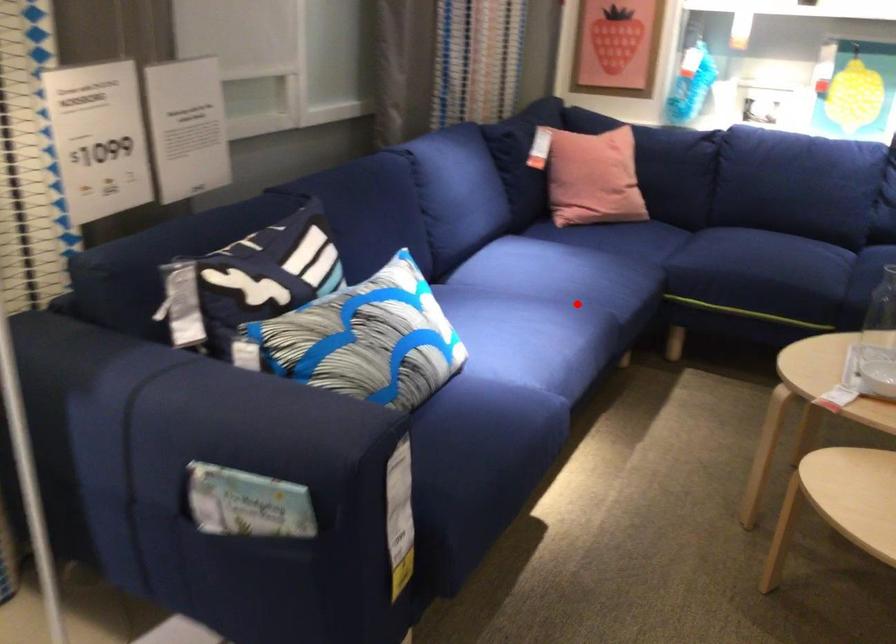
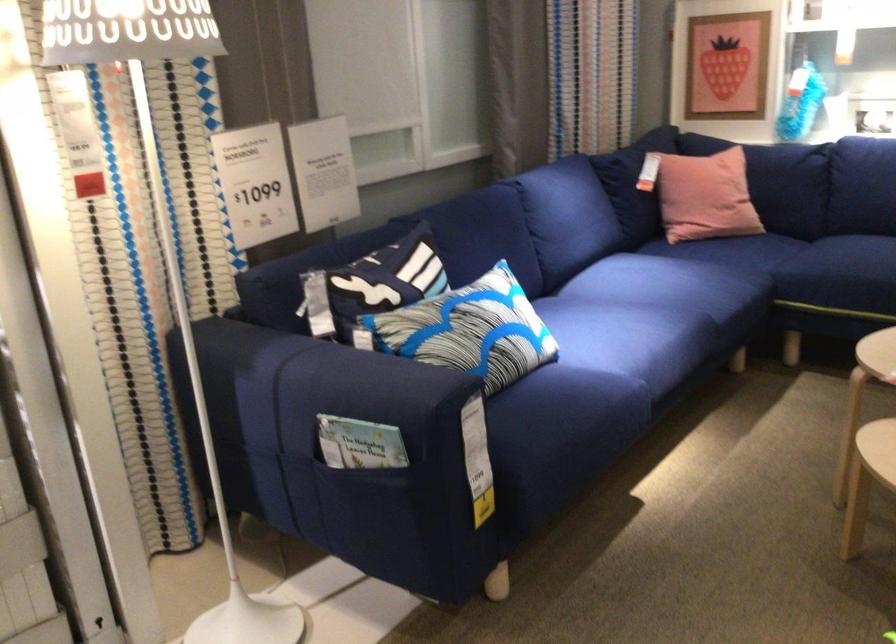
The point at the highlighted location is marked in the first image. Where is the corresponding point in the second image?

(676, 303)